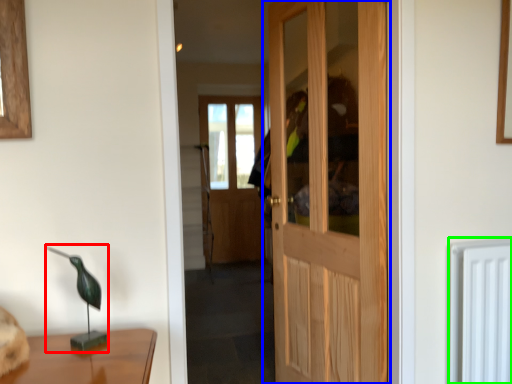
Question: Based on their relative distances, which object is nearer to table lamp (highlighted by a red box)? Choose from door (highlighted by a blue box) and radiator (highlighted by a green box).

Choices:
 (A) door
 (B) radiator

Answer: (B)